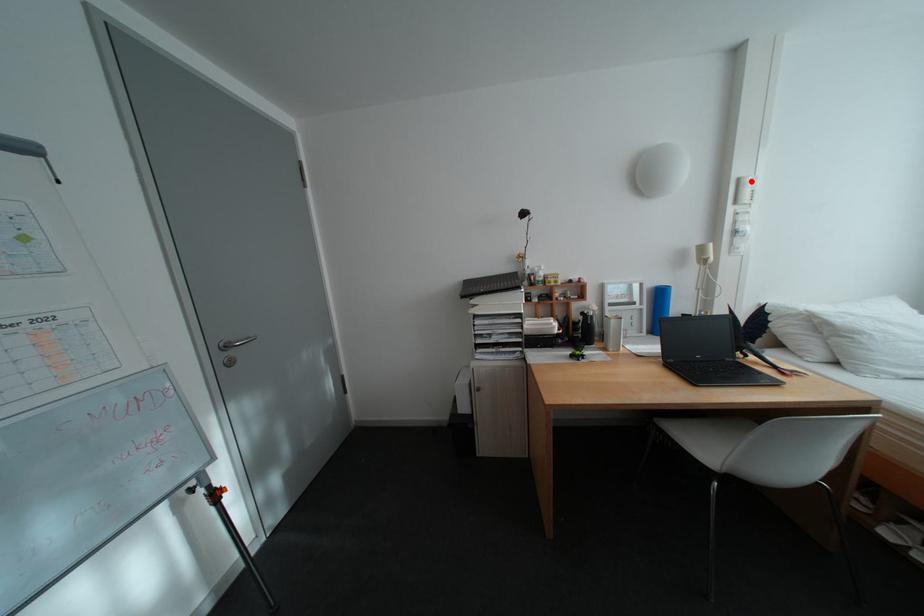
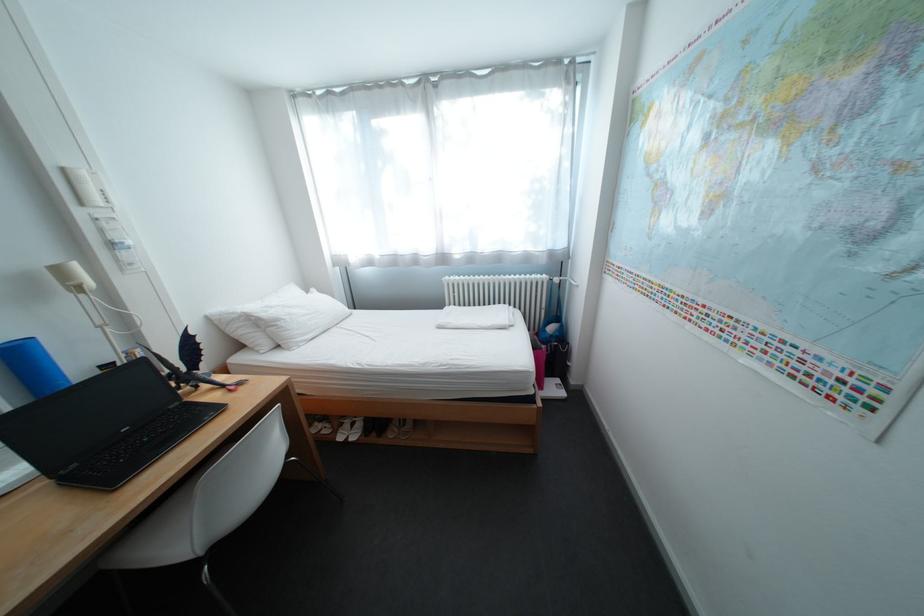
Where in the second image is the point corresponding to the highlighted location from the first image?

(76, 171)